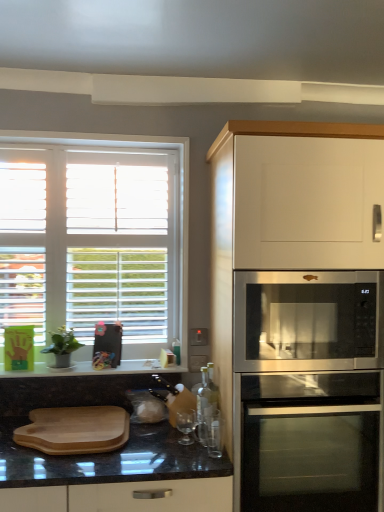
Question: Is point (314, 480) positioned closer to the camera than point (158, 283)?

Choices:
 (A) farther
 (B) closer

Answer: (B)

Question: From a real-world perspective, is white matte cabinet at upper right above or below white wood window at upper left?

Choices:
 (A) above
 (B) below

Answer: (B)

Question: Which object is positioned farthest from the granite black countertop at lower center?

Choices:
 (A) wooden cutting board at lower left
 (B) clear glass bottle at center
 (C) stainless steel oven at lower right
 (D) white wood window at upper left
 (E) stainless steel microwave at right

Answer: (E)

Question: Estimate the real-world distances between objects in this image. Which object is farther from the clear glass bottle at center?

Choices:
 (A) stainless steel microwave at right
 (B) white wood window at upper left
 (C) stainless steel oven at lower right
 (D) white matte cabinet at upper right
 (E) granite black countertop at lower center

Answer: (B)